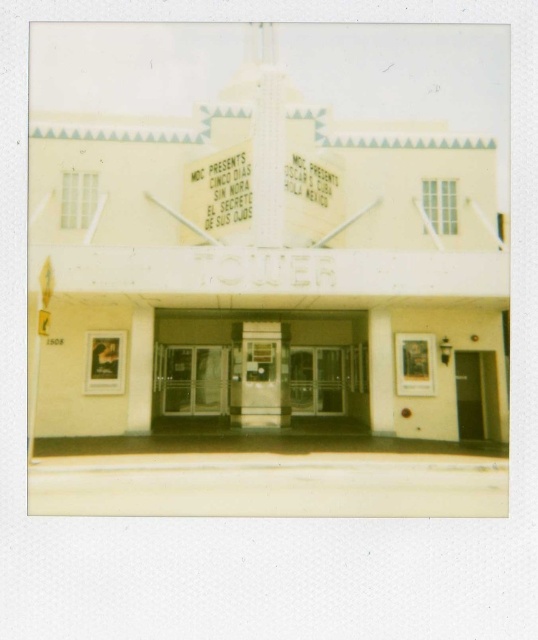
You are standing in front of the theater and want to enter through the translucent glass doors at center. Based on their position, can you estimate where exactly you should walk to reach them?

The translucent glass doors at center are located at point 0.580 on the x axis and 0.483 on the y axis, so you should walk towards the coordinates specified to reach them.

You are a person with a wheelchair who wants to enter the theater. The clear glass doors at center and the black glass door at center are the only entrance options. Which door should you choose to ensure there is enough space for your wheelchair to pass through?

The clear glass doors at center might be wider than black glass door at center, so it is more likely to accommodate your wheelchair. Choose the clear glass doors at center.

You are a delivery person carrying a package that is 1 meter wide. You need to enter the theater through the doors. Can you fit through the space between the translucent glass doors at center and the clear glass doors at center?

The translucent glass doors at center is 54.39 centimeters away from clear glass doors at center. Since the package is 1 meter wide, which is 100 centimeters, it is wider than the available space. Therefore, the package cannot fit through the gap between the translucent glass doors at center and the clear glass doors at center.